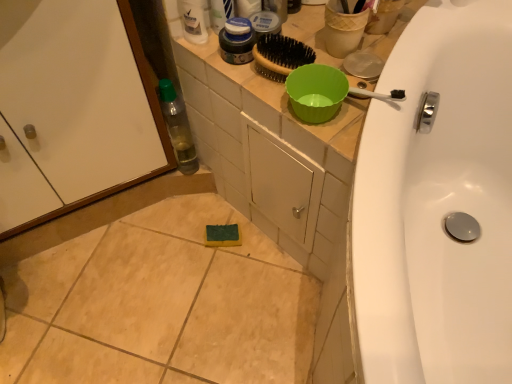
Question: Is white glossy bottle at upper center beside matte blue jar at upper center?

Choices:
 (A) no
 (B) yes

Answer: (B)

Question: Is white glossy bottle at upper center positioned in front of matte blue jar at upper center?

Choices:
 (A) yes
 (B) no

Answer: (B)

Question: Does white glossy bottle at upper center lie behind matte blue jar at upper center?

Choices:
 (A) yes
 (B) no

Answer: (A)

Question: Considering the relative sizes of white glossy bottle at upper center and matte blue jar at upper center in the image provided, is white glossy bottle at upper center thinner than matte blue jar at upper center?

Choices:
 (A) yes
 (B) no

Answer: (B)

Question: Can you confirm if white glossy bottle at upper center is smaller than matte blue jar at upper center?

Choices:
 (A) yes
 (B) no

Answer: (A)

Question: From a real-world perspective, is matte plastic mouthwash at upper center above or below transparent plastic bottle at left?

Choices:
 (A) above
 (B) below

Answer: (A)

Question: Is matte plastic mouthwash at upper center wider or thinner than transparent plastic bottle at left?

Choices:
 (A) wide
 (B) thin

Answer: (B)

Question: From their relative heights in the image, would you say matte plastic mouthwash at upper center is taller or shorter than transparent plastic bottle at left?

Choices:
 (A) short
 (B) tall

Answer: (A)

Question: Does point (252, 34) appear closer or farther from the camera than point (168, 129)?

Choices:
 (A) farther
 (B) closer

Answer: (B)

Question: Does point (x=219, y=1) appear closer or farther from the camera than point (x=237, y=23)?

Choices:
 (A) farther
 (B) closer

Answer: (A)

Question: From the image's perspective, is matte blue jar at upper center above or below matte plastic mouthwash at upper center?

Choices:
 (A) below
 (B) above

Answer: (B)

Question: Based on their sizes in the image, would you say matte blue jar at upper center is bigger or smaller than matte plastic mouthwash at upper center?

Choices:
 (A) small
 (B) big

Answer: (B)

Question: Is matte blue jar at upper center inside or outside of matte plastic mouthwash at upper center?

Choices:
 (A) outside
 (B) inside

Answer: (A)

Question: Based on their sizes in the image, would you say white glossy bottle at upper center is bigger or smaller than transparent plastic bottle at left?

Choices:
 (A) big
 (B) small

Answer: (B)

Question: From a real-world perspective, is white glossy bottle at upper center physically located above or below transparent plastic bottle at left?

Choices:
 (A) below
 (B) above

Answer: (B)